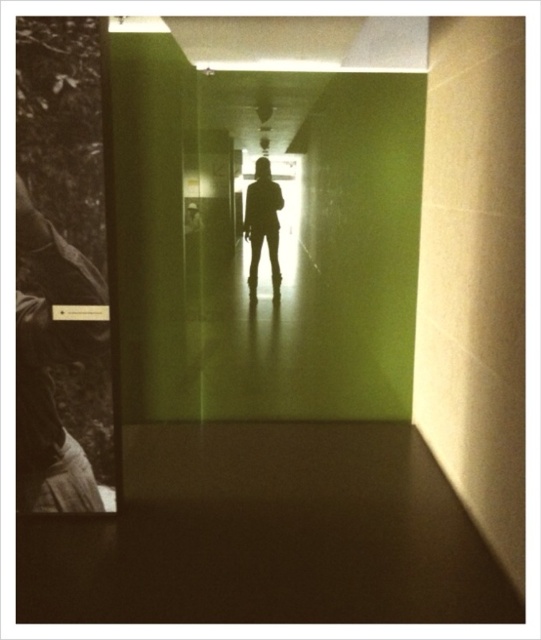
Does sepia-toned photograph of man at left have a lesser height compared to silhouette figure at center?

No.

Does point (39, 259) come in front of point (272, 250)?

Yes.

You are a GUI agent. You are given a task and a screenshot of the screen. Output one action in this format:
    pyautogui.click(x=<x>, y=<y>)
    Task: Click on the sepia-toned photograph of man at left
    
    Given the screenshot: What is the action you would take?
    pyautogui.click(x=50, y=364)